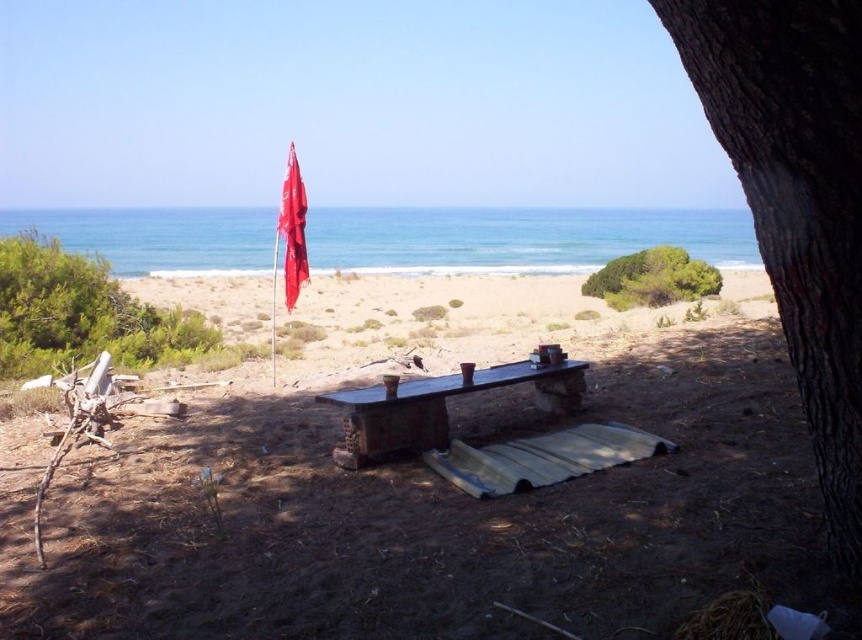
From the picture: You are planning to set up a small campsite near the brown rough bark tree at right and the brown sandy beach at center. Which of the two locations would you choose if you want to have more space for your campsite?

The brown sandy beach at center is a better choice for a larger campsite because the brown rough bark tree at right has a smaller size compared to the brown sandy beach at center, indicating the beach area offers more space.

You are planning to sit on the wooden bench at center. Will you be shaded by the red fabric flag at upper center?

Yes, the wooden bench at center is positioned under the red fabric flag at upper center, so sitting there will place you in its shade.